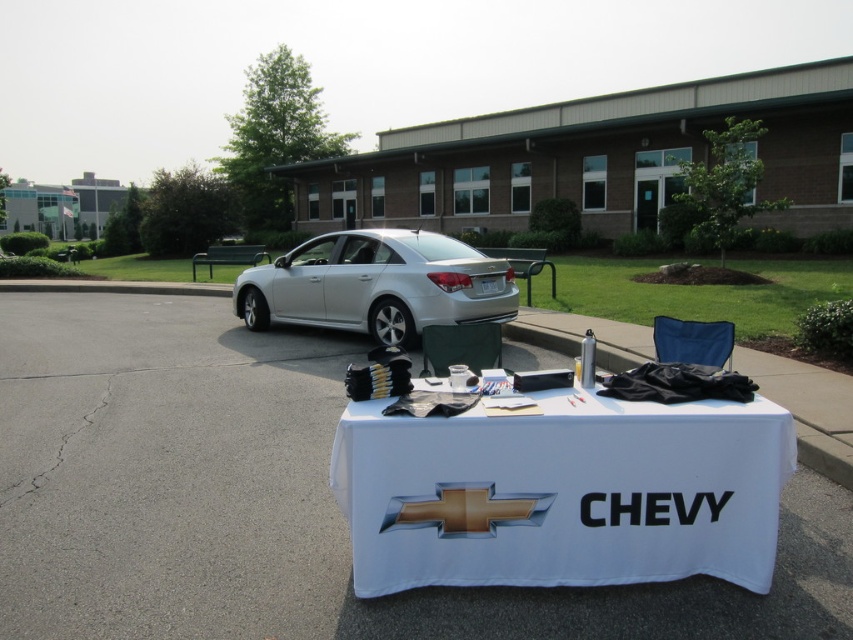
You are organizing a Chevrolet promotional event and need to rearrange the white fabric table at center and the silver metallic sedan at center. If you want to free up more space in the area, which object should you move?

The white fabric table at center occupies less space than the silver metallic sedan at center, so moving the silver metallic sedan at center would free up more space.

Consider the image. You are organizing an outdoor event and need to place a banner on the white fabric table at center and the silver metallic sedan at center. Which object requires a taller banner stand to accommodate its height?

The silver metallic sedan at center requires a taller banner stand because the white fabric table at center has a lesser height compared to it.

You are at a Chevrolet promotional event and want to grab a brochure from the white fabric table at center. After taking the brochure, you decide to walk towards the silver metallic sedan at center to inspect it. Which direction should you move relative to the table?

Since the white fabric table at center is closer to the viewer than the silver metallic sedan at center, you should move away from the table towards the sedan.